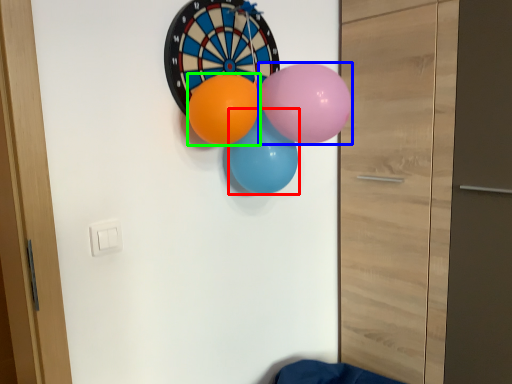
Question: Estimate the real-world distances between objects in this image. Which object is closer to balloon (highlighted by a red box), balloon (highlighted by a blue box) or balloon (highlighted by a green box)?

Choices:
 (A) balloon
 (B) balloon

Answer: (B)